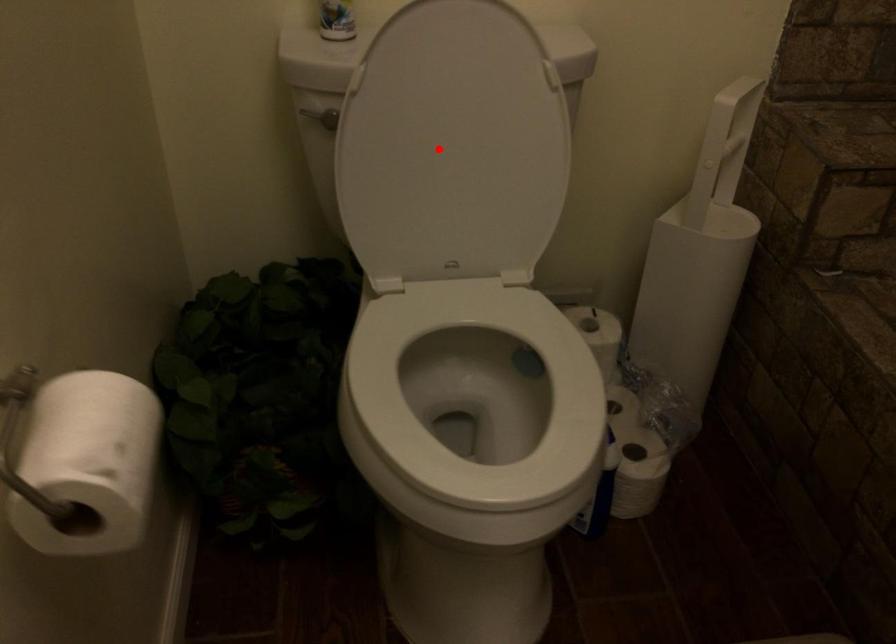
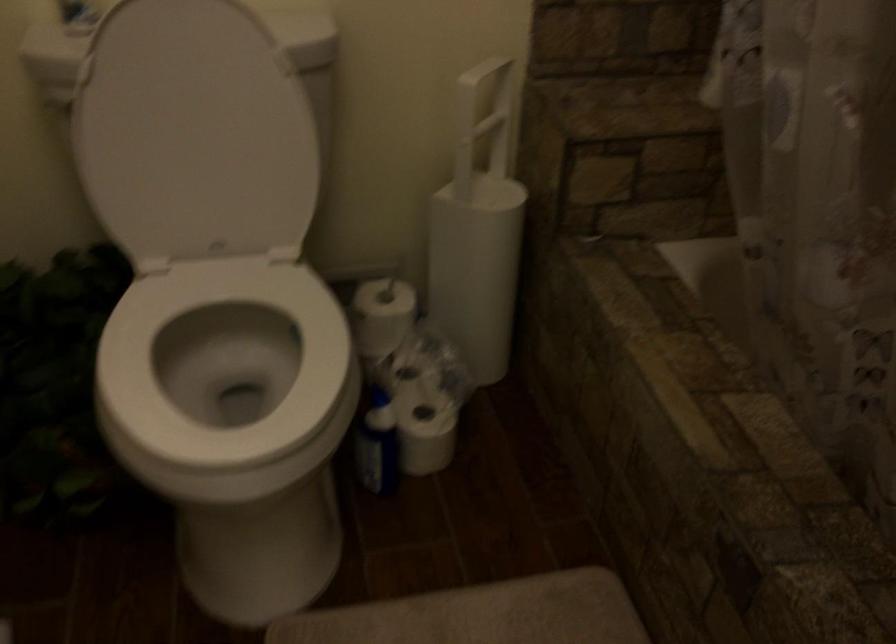
In the second image, find the point that corresponds to the highlighted location in the first image.

(194, 134)